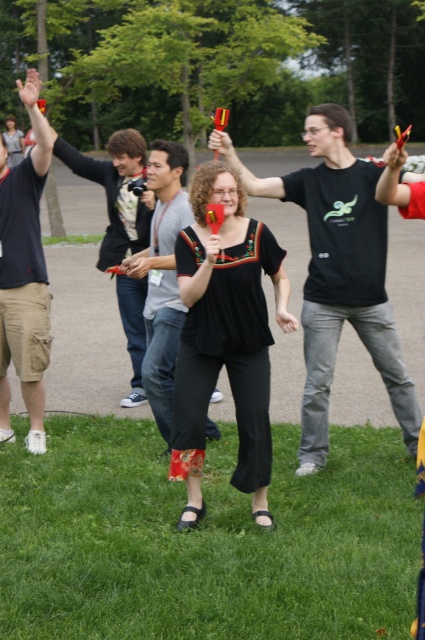
Is black cotton t-shirt at center to the right of matte khaki shorts at left from the viewer's perspective?

Correct, you'll find black cotton t-shirt at center to the right of matte khaki shorts at left.

Is black cotton t-shirt at center bigger than matte khaki shorts at left?

Correct, black cotton t-shirt at center is larger in size than matte khaki shorts at left.

Who is more distant from viewer, (376,280) or (36,163)?

Positioned behind is point (36,163).

Locate an element on the screen. black cotton t-shirt at center is located at coordinates (337, 273).

Looking at this image, can you confirm if matte khaki shorts at left is positioned below matte gray shirt at center?

Incorrect, matte khaki shorts at left is not positioned below matte gray shirt at center.

What do you see at coordinates (23, 273) in the screenshot? I see `matte khaki shorts at left` at bounding box center [23, 273].

Locate an element on the screen. The image size is (425, 640). matte khaki shorts at left is located at coordinates (23, 273).

What are the coordinates of `black cotton t-shirt at center` in the screenshot? It's located at (337, 273).

Find the location of a particular element. This screenshot has width=425, height=640. black cotton t-shirt at center is located at coordinates (x=337, y=273).